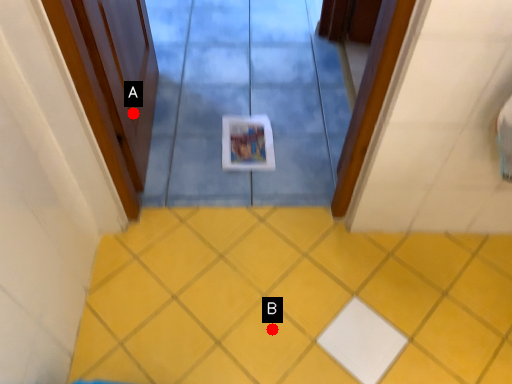
Question: Two points are circled on the image, labeled by A and B beside each circle. Which point is farther to the camera?

Choices:
 (A) A is further
 (B) B is further

Answer: (A)